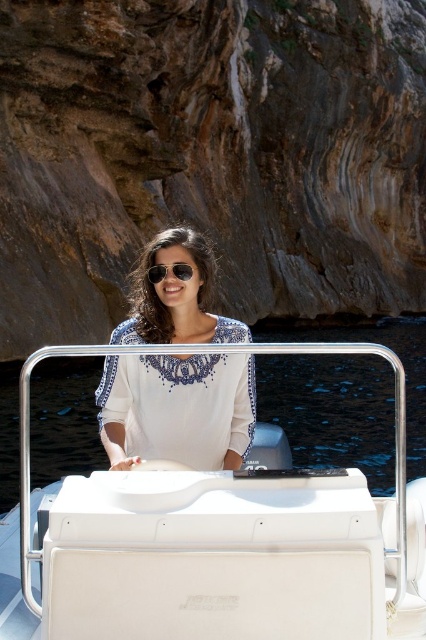
Question: Which point is farther to the camera?

Choices:
 (A) matte brown rock at center
 (B) white embroidered blouse at center
 (C) white matte boat at center

Answer: (A)

Question: Is matte brown rock at center smaller than white matte boat at center?

Choices:
 (A) yes
 (B) no

Answer: (B)

Question: Considering the relative positions of white matte boat at center and white embroidered blouse at center in the image provided, where is white matte boat at center located with respect to white embroidered blouse at center?

Choices:
 (A) right
 (B) left

Answer: (A)

Question: Which object appears farthest from the camera in this image?

Choices:
 (A) white matte boat at center
 (B) white embroidered blouse at center
 (C) matte black sunglasses at center
 (D) matte brown rock at center

Answer: (D)

Question: Which object is closer to the camera taking this photo?

Choices:
 (A) white matte boat at center
 (B) matte black sunglasses at center
 (C) matte brown rock at center

Answer: (A)

Question: Can you confirm if white matte boat at center is thinner than white embroidered blouse at center?

Choices:
 (A) no
 (B) yes

Answer: (A)